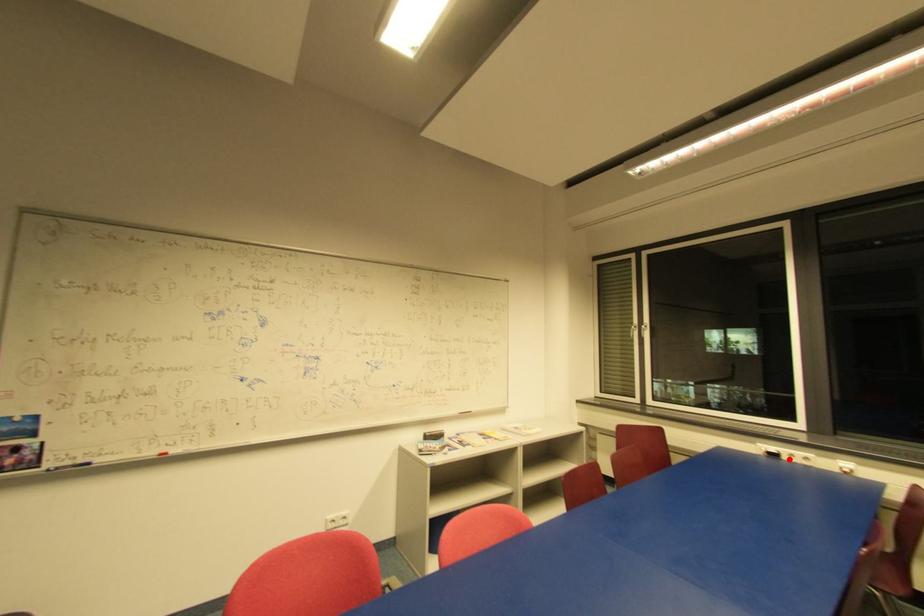
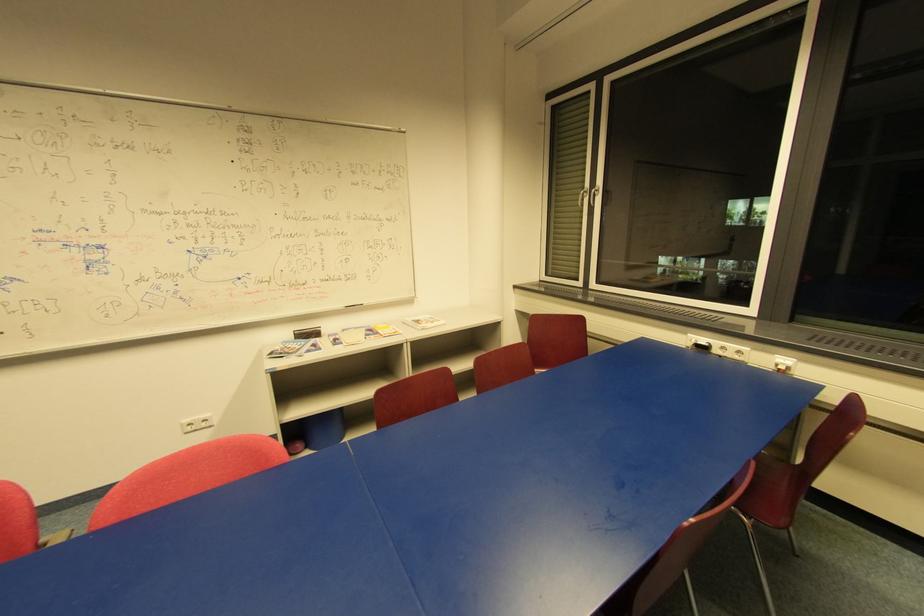
In the second image, find the point that corresponds to the highlighted location in the first image.

(720, 352)